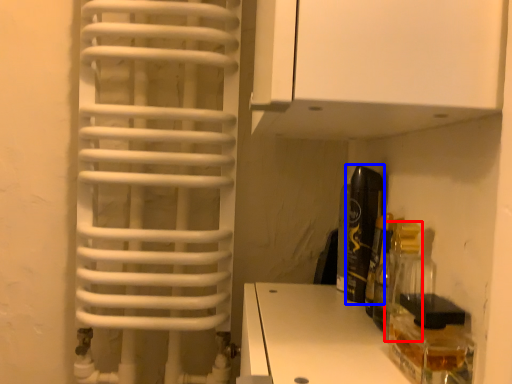
Question: Among these objects, which one is farthest to the camera, bottle (highlighted by a red box) or bottle (highlighted by a blue box)?

Choices:
 (A) bottle
 (B) bottle

Answer: (B)